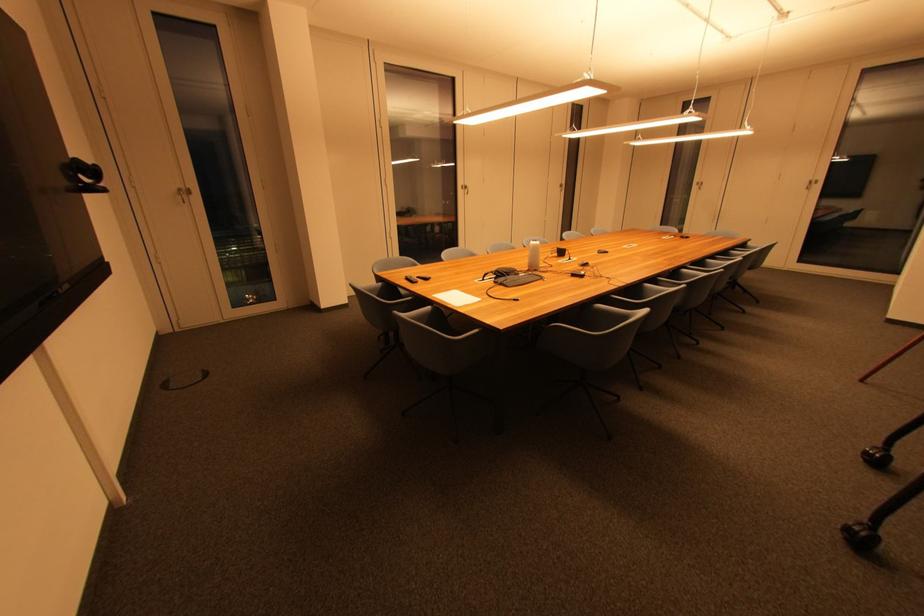
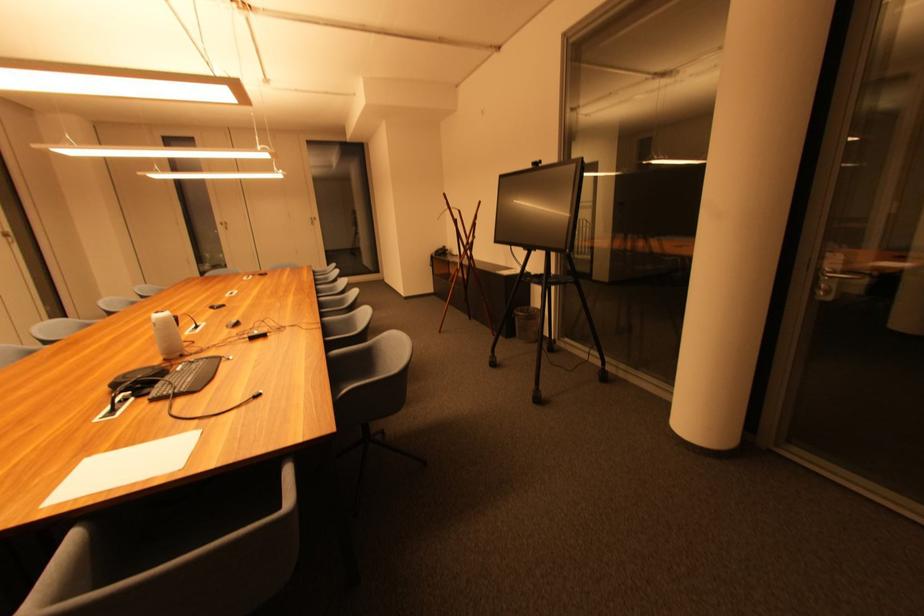
In the second image, find the point that corresponds to (703,185) in the first image.

(226, 225)